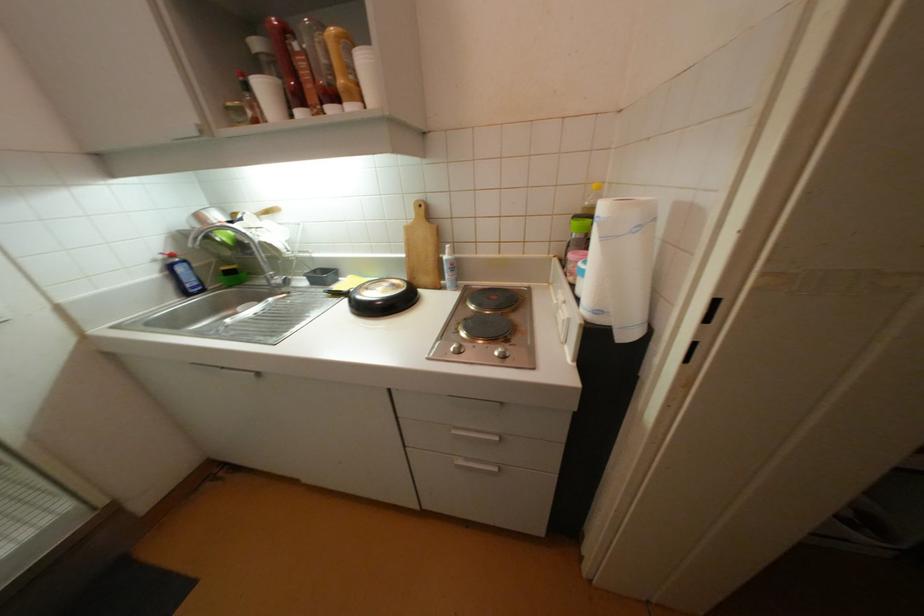
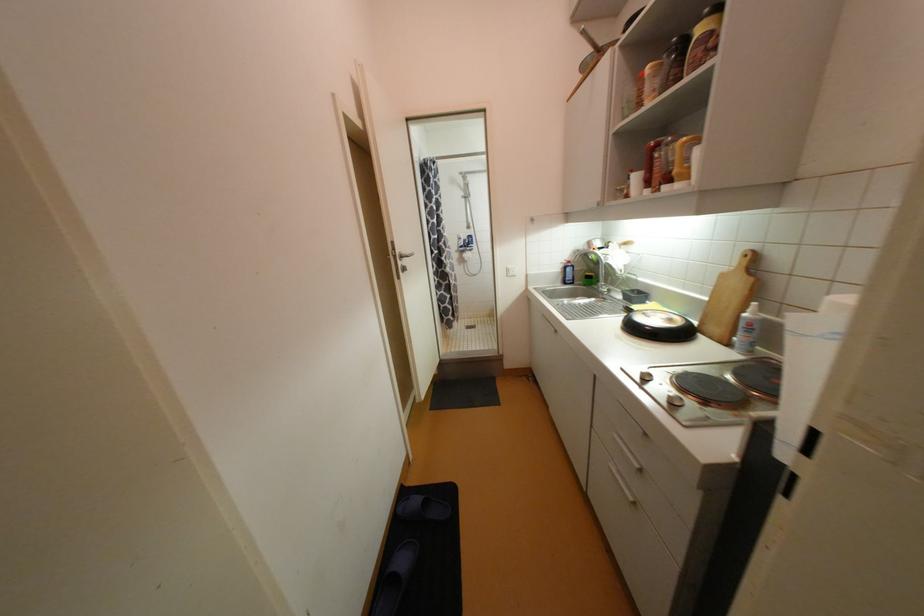
Find the pixel in the second image that matches the point at 503,440 in the first image.

(641, 467)